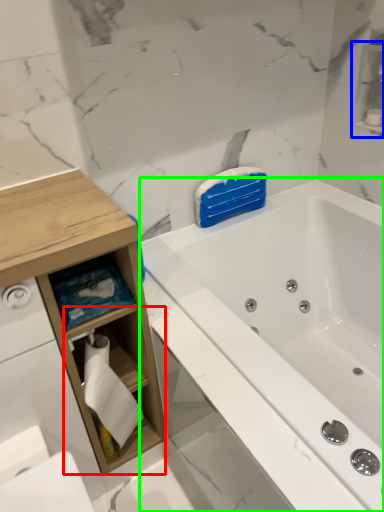
Question: Based on their relative distances, which object is nearer to cabinet (highlighted by a red box)? Choose from cabinet (highlighted by a blue box) and bathtub (highlighted by a green box).

Choices:
 (A) cabinet
 (B) bathtub

Answer: (B)